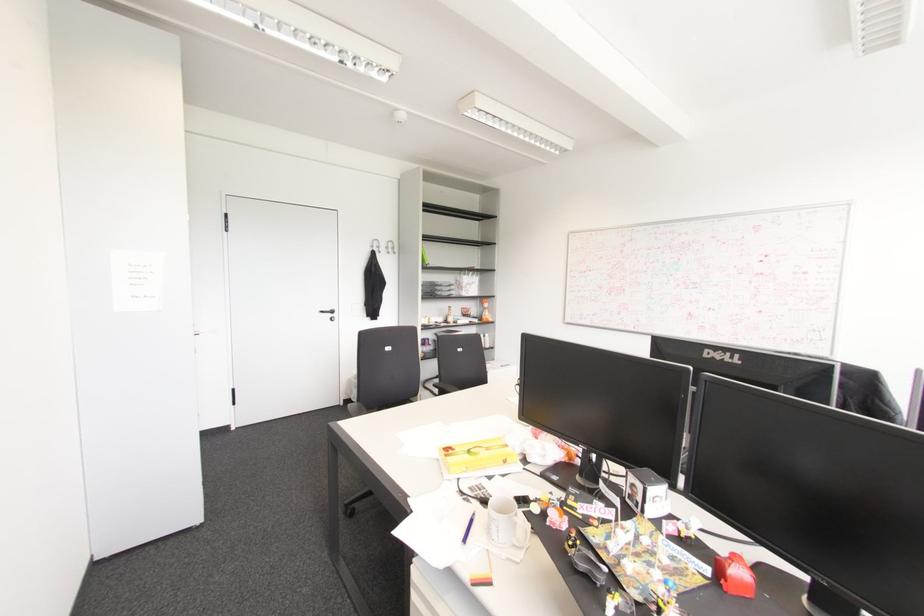
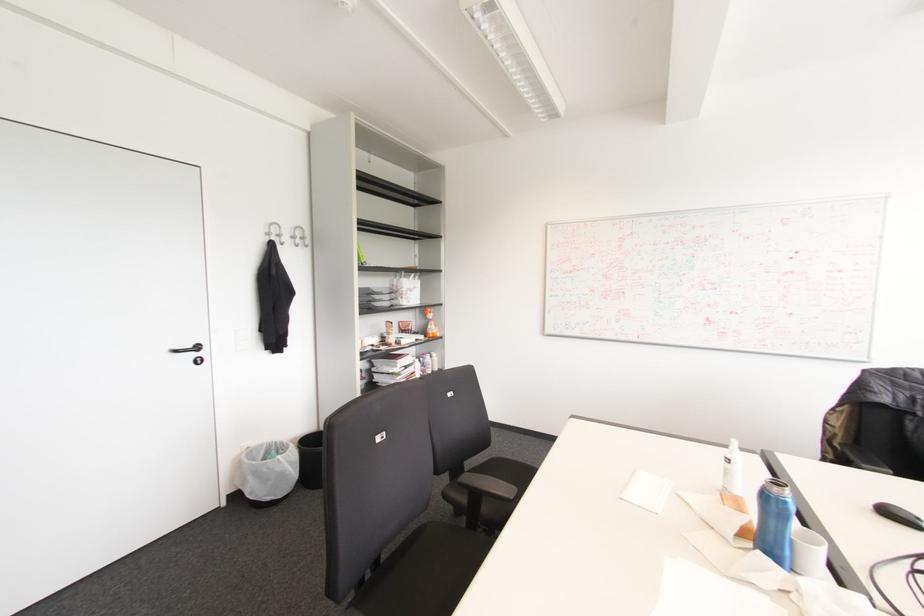
Where in the second image is the point corresponding to pixel 332 310 from the first image?

(197, 347)